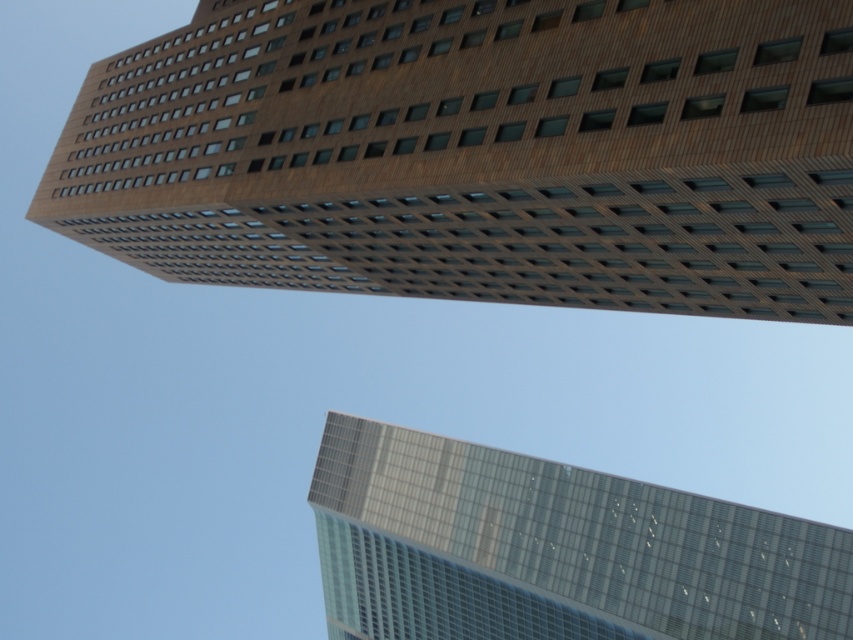
Is brown brick building at upper center bigger than transparent glass skyscraper at lower right?

No.

Can you confirm if brown brick building at upper center is positioned to the right of transparent glass skyscraper at lower right?

Incorrect, brown brick building at upper center is not on the right side of transparent glass skyscraper at lower right.

Who is more distant from viewer, (346, 72) or (708, 552)?

The point (708, 552) is more distant.

At what (x,y) coordinates should I click in order to perform the action: click on brown brick building at upper center. Please return your answer as a coordinate pair (x, y). Looking at the image, I should click on (479, 152).